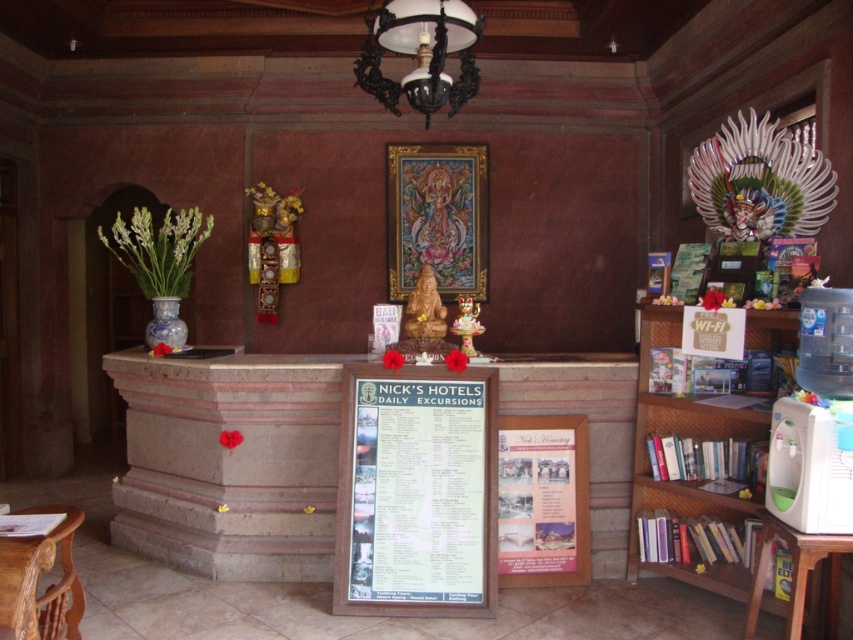
Consider the image. You are a guest in the hotel lobby and want to read the white paper poster at center. However, you notice that the wooden bookshelf at right is blocking your view. Can you still see the poster clearly?

The wooden bookshelf at right is behind the white paper poster at center, so the bookshelf is not blocking your view. You can still see the poster clearly.

You are standing in the lobby and need to locate both the wooden bookshelf at right and the white matte lampshade at upper center. From your current position, which object is positioned to the east?

The wooden bookshelf at right is to the right of the white matte lampshade at upper center, so if you are facing the scene, the wooden bookshelf at right would be to the east of the white matte lampshade at upper center.

You are standing in the reception area and see a wooden table at lower left. Is there a point at coordinate (38,579) on it?

Yes, the point at coordinate (38,579) is on the wooden table at lower left.